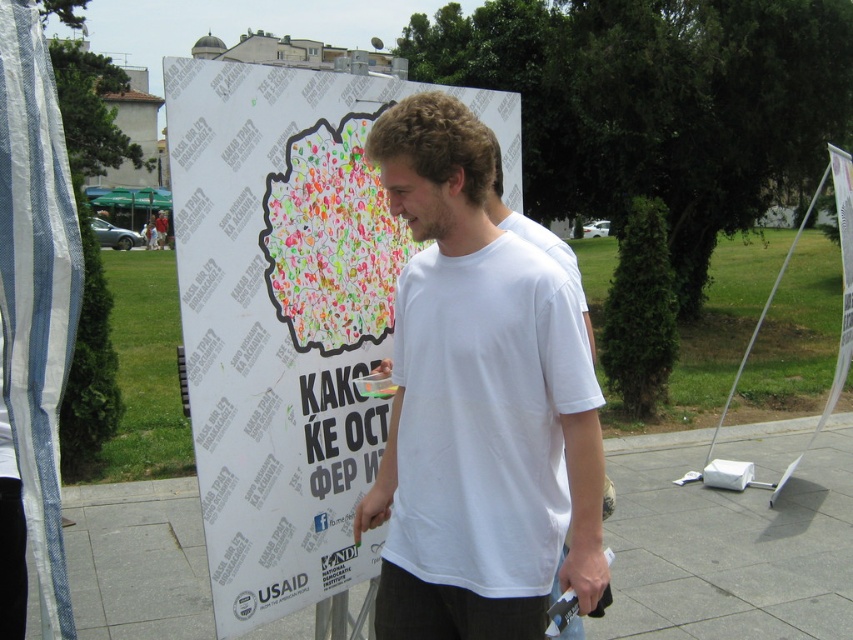
You are a photographer trying to capture a photo of the informational poster. You notice two points marked on the poster at coordinates point (310, 280) and point (480, 451). Which point is closer to the camera based on their positions?

Point (480, 451) is closer to the camera because it is in front of point (310, 280).

You are a delivery person who needs to deliver a package to the exact location of the white paper poster at center. According to the GPS coordinates provided, where should you go to place the package?

The white paper poster at center is located at coordinates point [287,316], so you should go to that point to place the package.